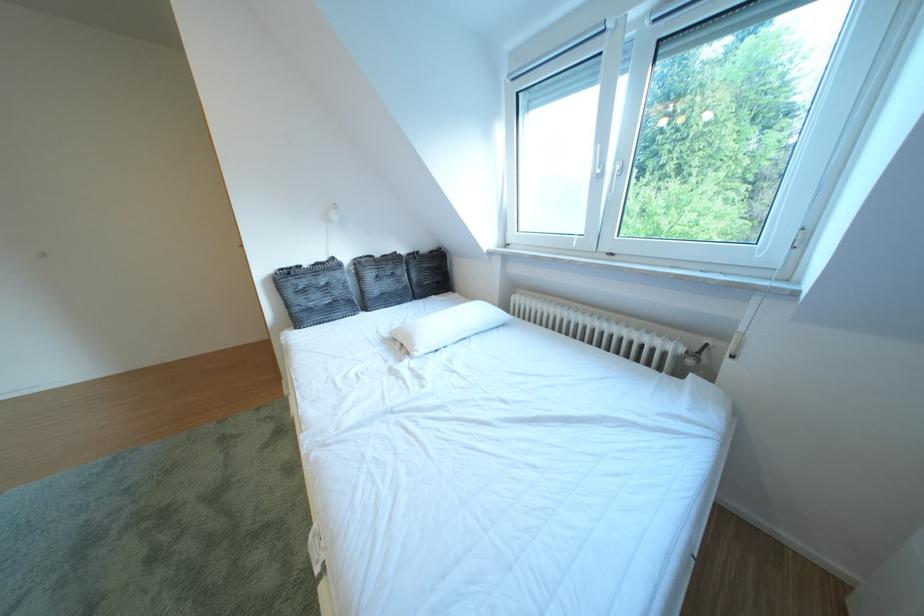
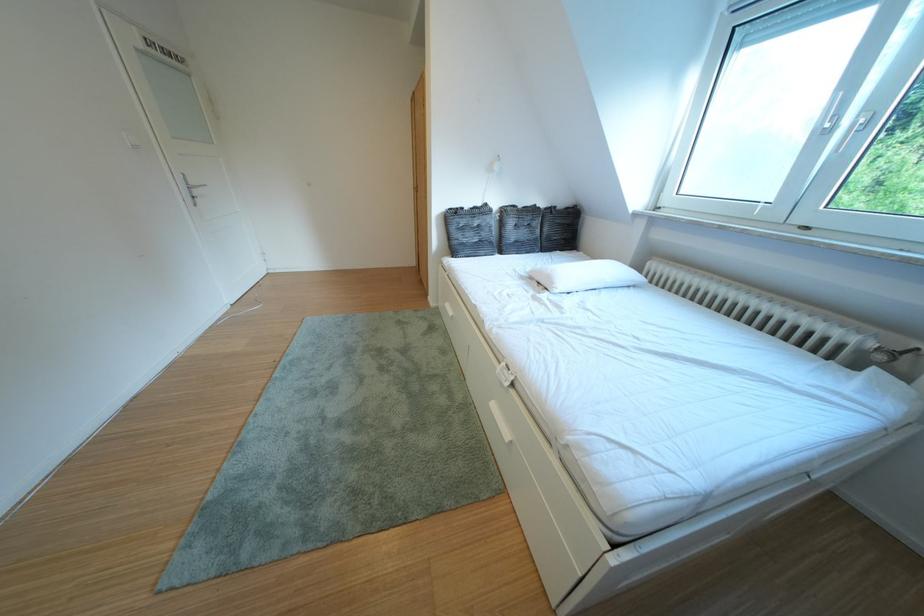
Locate, in the second image, the point that corresponds to point 704,367 in the first image.

(893, 363)